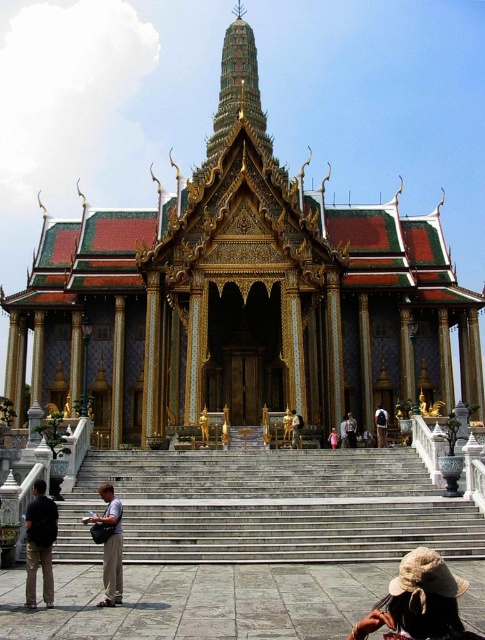
Question: Which object is positioned farthest from the brown woven hat at lower right?

Choices:
 (A) gold metallic statue at center
 (B) golden statue at center

Answer: (A)

Question: Which point is closer to the camera?

Choices:
 (A) gold/gilded wood palace at center
 (B) matte gray backpack at lower left
 (C) black cotton shirt at lower left
 (D) golden statue at center

Answer: (C)

Question: Which of the following is the closest to the observer?

Choices:
 (A) golden statue at center
 (B) pink fabric dress at center
 (C) gold/gilded wood palace at center

Answer: (A)

Question: Does golden statue at center appear on the left side of light brown wooden chair at center?

Choices:
 (A) no
 (B) yes

Answer: (B)

Question: Can you confirm if white marble stairs at center is positioned above light brown wooden chair at center?

Choices:
 (A) no
 (B) yes

Answer: (A)

Question: Is brown woven hat at lower right to the right of black cotton shirt at lower left from the viewer's perspective?

Choices:
 (A) no
 (B) yes

Answer: (B)